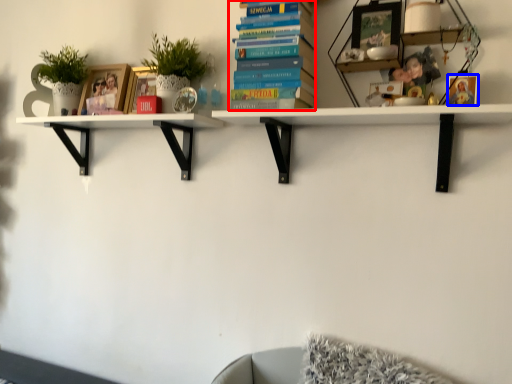
Question: Among these objects, which one is farthest to the camera, book (highlighted by a red box) or picture frame (highlighted by a blue box)?

Choices:
 (A) book
 (B) picture frame

Answer: (A)